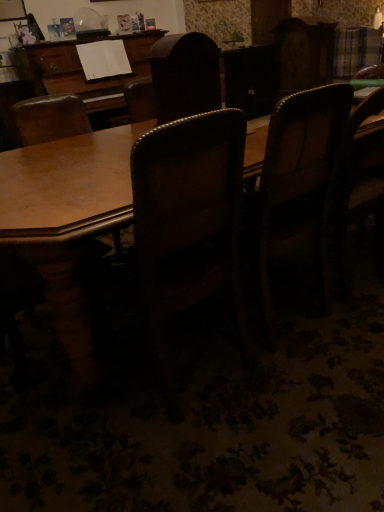
Question: Is wooden chair at right, the 1th chair viewed from the right, in contact with wooden table at center?

Choices:
 (A) yes
 (B) no

Answer: (B)

Question: Considering the relative sizes of wooden chair at right, the 1th chair viewed from the right, and wooden table at center in the image provided, is wooden chair at right, the 1th chair viewed from the right, bigger than wooden table at center?

Choices:
 (A) yes
 (B) no

Answer: (B)

Question: Can you confirm if wooden chair at right, the 1th chair viewed from the right, is positioned to the left of wooden table at center?

Choices:
 (A) yes
 (B) no

Answer: (B)

Question: Does wooden chair at right, the 1th chair viewed from the right, lie in front of wooden table at center?

Choices:
 (A) no
 (B) yes

Answer: (A)

Question: Does wooden chair at right, the 1th chair viewed from the right, have a lesser height compared to wooden table at center?

Choices:
 (A) yes
 (B) no

Answer: (B)

Question: Is wooden table at center at the back of wooden chair at right, the 1th chair viewed from the right?

Choices:
 (A) yes
 (B) no

Answer: (A)

Question: Is wooden table at center taller than wooden chair at right, marked as the 4th chair in a left-to-right arrangement?

Choices:
 (A) yes
 (B) no

Answer: (B)

Question: From the image's perspective, is wooden table at center above wooden chair at right, marked as the 4th chair in a left-to-right arrangement?

Choices:
 (A) no
 (B) yes

Answer: (A)

Question: Could wooden chair at right, the 1th chair viewed from the right, be considered to be inside wooden table at center?

Choices:
 (A) yes
 (B) no

Answer: (A)

Question: Does wooden table at center appear on the left side of wooden chair at right, the 1th chair viewed from the right?

Choices:
 (A) no
 (B) yes

Answer: (B)

Question: Considering the relative sizes of wooden table at center and wooden chair at right, the 1th chair viewed from the right, in the image provided, is wooden table at center bigger than wooden chair at right, the 1th chair viewed from the right,?

Choices:
 (A) yes
 (B) no

Answer: (A)

Question: Is wooden table at center not within wooden chair at right, the 1th chair viewed from the right?

Choices:
 (A) no
 (B) yes

Answer: (B)

Question: Does dark wood chair at right, the second chair positioned from the right, have a smaller size compared to wooden chair at center, the fourth chair in the right-to-left sequence?

Choices:
 (A) no
 (B) yes

Answer: (B)